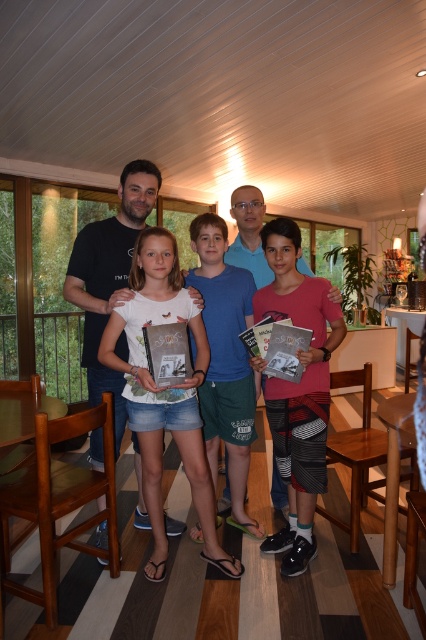
Question: Does white cotton shirt at center appear over white cotton t-shirt at center?

Choices:
 (A) yes
 (B) no

Answer: (B)

Question: Which of the following is the closest to the observer?

Choices:
 (A) (143, 400)
 (B) (276, 417)
 (C) (92, 436)

Answer: (A)

Question: Among these objects, which one is nearest to the camera?

Choices:
 (A) white cotton t-shirt at center
 (B) white cotton shirt at center
 (C) pink matte shirt at center

Answer: (B)

Question: Based on their relative distances, which object is nearer to the pink matte shirt at center?

Choices:
 (A) white cotton shirt at center
 (B) white cotton t-shirt at center

Answer: (A)

Question: Is white cotton shirt at center bigger than pink matte shirt at center?

Choices:
 (A) no
 (B) yes

Answer: (B)

Question: Is white cotton shirt at center bigger than pink matte shirt at center?

Choices:
 (A) yes
 (B) no

Answer: (A)